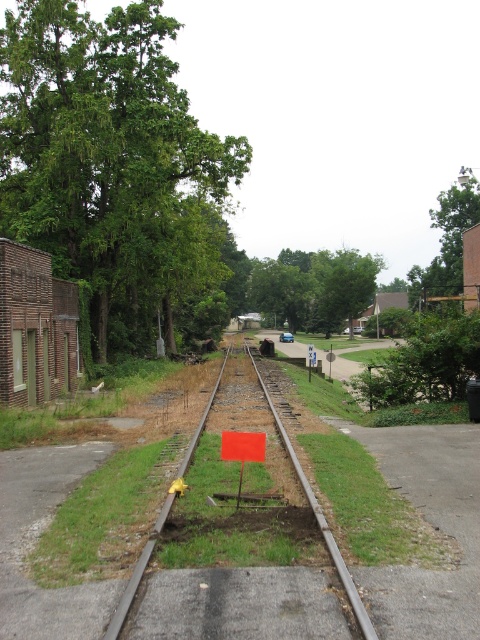
Does orange plastic sign at center have a lesser width compared to blue plastic sign at center?

Indeed, orange plastic sign at center has a lesser width compared to blue plastic sign at center.

Is orange plastic sign at center below blue plastic sign at center?

Yes, orange plastic sign at center is below blue plastic sign at center.

What are the coordinates of `orange plastic sign at center` in the screenshot? It's located at (242, 445).

Can you confirm if smooth metal train track at center is smaller than blue plastic sign at center?

Indeed, smooth metal train track at center has a smaller size compared to blue plastic sign at center.

Can you confirm if smooth metal train track at center is bigger than blue plastic sign at center?

No, smooth metal train track at center is not bigger than blue plastic sign at center.

The width and height of the screenshot is (480, 640). Describe the element at coordinates (320, 518) in the screenshot. I see `smooth metal train track at center` at that location.

Find the location of a particular element. smooth metal train track at center is located at coordinates click(x=320, y=518).

Who is positioned more to the left, smooth metal train track at center or orange plastic sign at center?

orange plastic sign at center is more to the left.

Is smooth metal train track at center wider than orange plastic sign at center?

Yes.

Where is `smooth metal train track at center`? smooth metal train track at center is located at coordinates (320, 518).